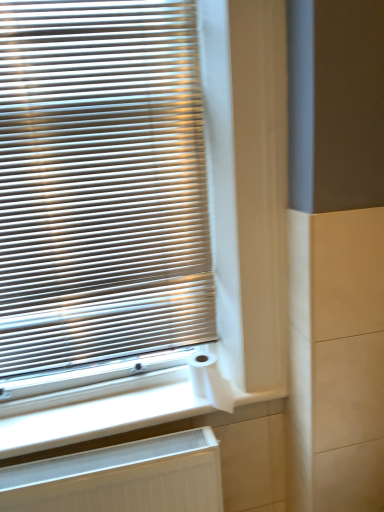
The width and height of the screenshot is (384, 512). I want to click on white matte toilet paper at lower center, so click(210, 381).

How different are the orientations of matte silver blinds at left and white matte toilet paper at lower center in degrees?

The angle between the facing direction of matte silver blinds at left and the facing direction of white matte toilet paper at lower center is 3.17 degrees.

Between matte silver blinds at left and white matte toilet paper at lower center, which one has larger size?

With larger size is matte silver blinds at left.

Which is more to the right, matte silver blinds at left or white matte toilet paper at lower center?

Positioned to the right is white matte toilet paper at lower center.

Is point (201, 362) positioned behind point (77, 509)?

Yes, it is behind point (77, 509).

Considering the relative positions of white matte toilet paper at lower center and white ribbed radiator at lower left in the image provided, is white matte toilet paper at lower center to the left of white ribbed radiator at lower left from the viewer's perspective?

No, white matte toilet paper at lower center is not to the left of white ribbed radiator at lower left.

Find the location of a particular element. radiator on the left side of white matte toilet paper at lower center is located at coordinates coord(122,478).

Between white ribbed radiator at lower left and matte silver blinds at left, which one has larger width?

white ribbed radiator at lower left.

In order to click on window blind that appears in front of the white ribbed radiator at lower left in this screenshot , I will do `click(101, 183)`.

Is white ribbed radiator at lower left positioned with its back to matte silver blinds at left?

white ribbed radiator at lower left is not turned away from matte silver blinds at left.

How distant is white matte toilet paper at lower center from matte silver blinds at left?

white matte toilet paper at lower center is 22.94 inches away from matte silver blinds at left.

Which point is more distant from viewer, (210, 385) or (124, 158)?

Positioned behind is point (210, 385).

At what (x,y) coordinates should I click in order to perform the action: click on window blind that is on the left side of white matte toilet paper at lower center. Please return your answer as a coordinate pair (x, y). This screenshot has height=512, width=384. Looking at the image, I should click on (101, 183).

From a real-world perspective, which object rests below the other?

white matte toilet paper at lower center is physically lower.

Which of these two, matte silver blinds at left or white ribbed radiator at lower left, is bigger?

Bigger between the two is matte silver blinds at left.

From the image's perspective, which is below, matte silver blinds at left or white ribbed radiator at lower left?

white ribbed radiator at lower left appears lower in the image.

This screenshot has height=512, width=384. I want to click on radiator behind the matte silver blinds at left, so click(122, 478).

Is matte silver blinds at left completely or partially outside of white ribbed radiator at lower left?

That's correct, matte silver blinds at left is outside of white ribbed radiator at lower left.

Considering the relative sizes of white ribbed radiator at lower left and white matte toilet paper at lower center in the image provided, is white ribbed radiator at lower left smaller than white matte toilet paper at lower center?

No, white ribbed radiator at lower left is not smaller than white matte toilet paper at lower center.

From the picture: Can you confirm if white ribbed radiator at lower left is wider than white matte toilet paper at lower center?

In fact, white ribbed radiator at lower left might be narrower than white matte toilet paper at lower center.

Looking at this image, is the depth of white ribbed radiator at lower left greater than that of white matte toilet paper at lower center?

No, it is not.

Where is `toilet paper located below the matte silver blinds at left (from the image's perspective)`? This screenshot has width=384, height=512. toilet paper located below the matte silver blinds at left (from the image's perspective) is located at coordinates (210, 381).

Identify the location of toilet paper located above the white ribbed radiator at lower left (from a real-world perspective). (210, 381).

When comparing their distances from matte silver blinds at left, does white matte toilet paper at lower center or white ribbed radiator at lower left seem closer?

Based on the image, white ribbed radiator at lower left appears to be nearer to matte silver blinds at left.

From the image, which object appears to be farther from matte silver blinds at left, white ribbed radiator at lower left or white matte toilet paper at lower center?

white matte toilet paper at lower center lies further to matte silver blinds at left than the other object.

Which object lies nearer to the anchor point white ribbed radiator at lower left, matte silver blinds at left or white matte toilet paper at lower center?

white matte toilet paper at lower center is positioned closer to the anchor white ribbed radiator at lower left.

When comparing their distances from white matte toilet paper at lower center, does matte silver blinds at left or white ribbed radiator at lower left seem further?

The object further to white matte toilet paper at lower center is matte silver blinds at left.

Considering their positions, is white ribbed radiator at lower left positioned closer to white matte toilet paper at lower center than matte silver blinds at left?

The object closer to white matte toilet paper at lower center is white ribbed radiator at lower left.

Based on their spatial positions, is white matte toilet paper at lower center or matte silver blinds at left closer to white ribbed radiator at lower left?

white matte toilet paper at lower center lies closer to white ribbed radiator at lower left than the other object.

Locate an element on the screen. This screenshot has height=512, width=384. toilet paper between matte silver blinds at left and white ribbed radiator at lower left vertically is located at coordinates (210, 381).